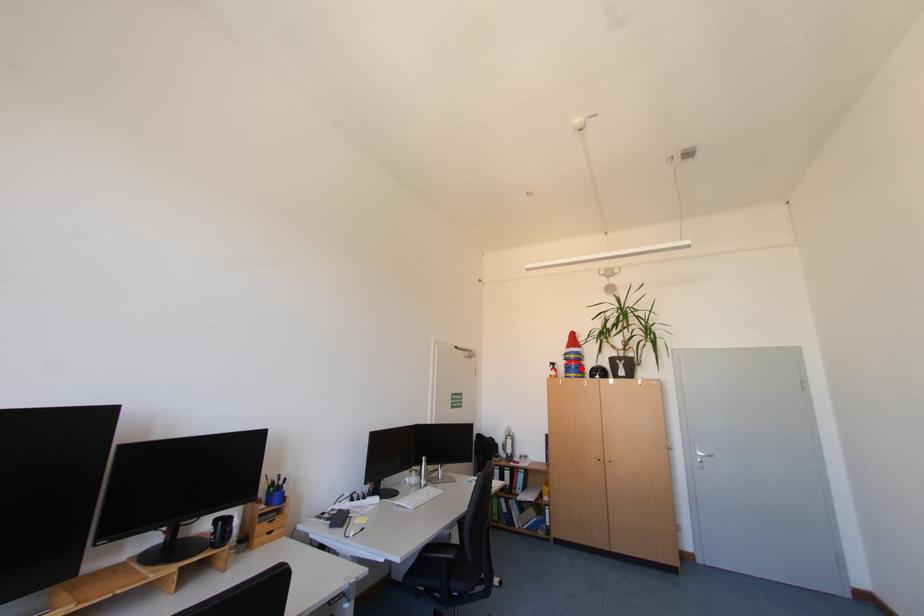
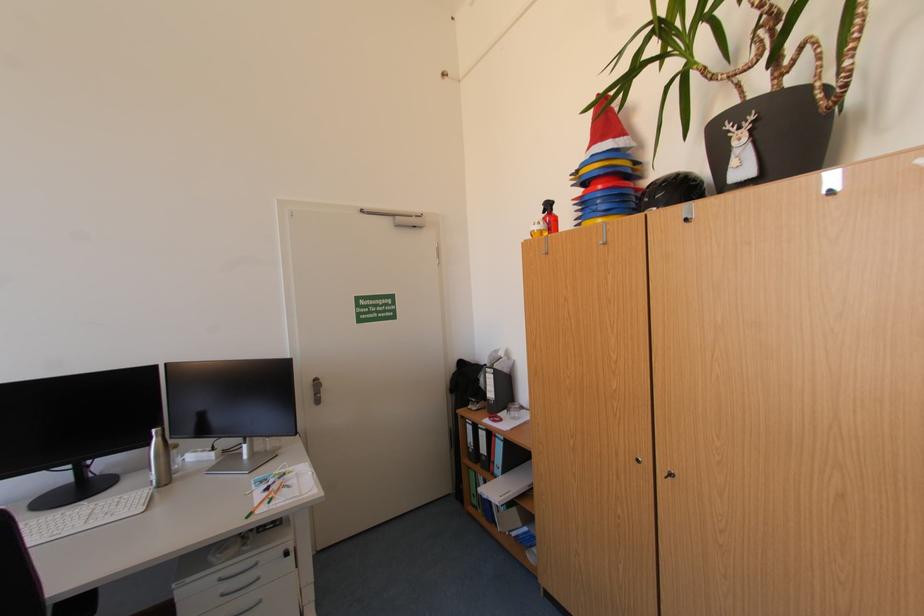
Question: I am providing you with two images of the same scene from different viewpoints. A red point is marked on the first image. At the location where the point appears in image 1, is it still visible in image 2?

Choices:
 (A) Yes
 (B) No

Answer: (A)